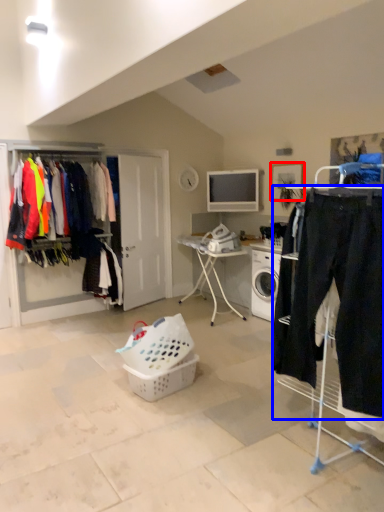
Question: Which point is further to the camera, picture frame (highlighted by a red box) or clothing (highlighted by a blue box)?

Choices:
 (A) picture frame
 (B) clothing

Answer: (A)